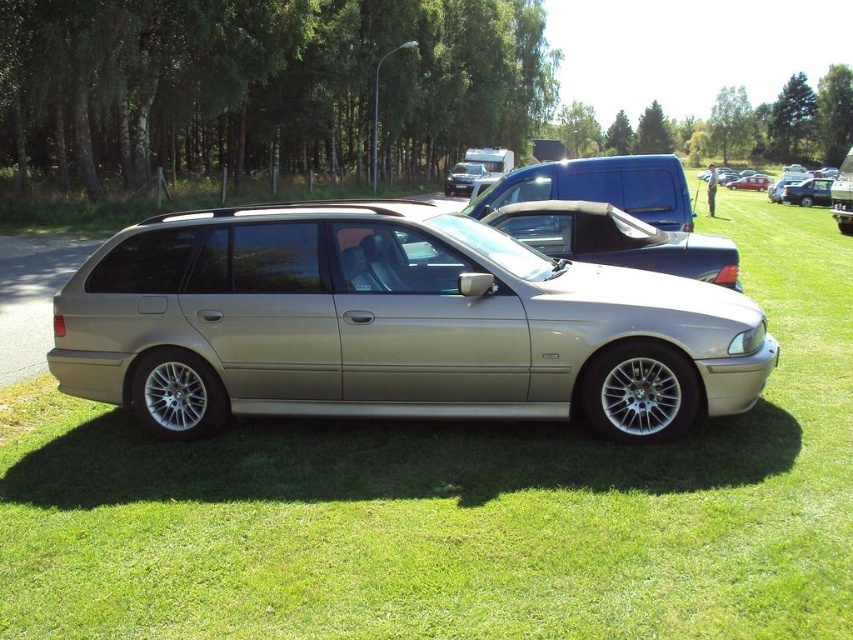
Question: Which object appears farthest from the camera in this image?

Choices:
 (A) blue matte van at center
 (B) metallic silver sedan at center
 (C) black plastic license plate at center

Answer: (B)

Question: Does metallic silver sedan at center appear under black plastic license plate at center?

Choices:
 (A) yes
 (B) no

Answer: (B)

Question: Which of the following is the closest to the observer?

Choices:
 (A) (635, 516)
 (B) (103, 296)
 (C) (827, 177)

Answer: (A)

Question: Which object appears farthest from the camera in this image?

Choices:
 (A) metallic silver car at center
 (B) metallic silver station wagon at center
 (C) blue matte van at center

Answer: (B)

Question: Is metallic silver car at center wider than metallic silver sedan at center?

Choices:
 (A) yes
 (B) no

Answer: (A)

Question: Considering the relative positions of satin silver car at center and metallic silver station wagon at center in the image provided, where is satin silver car at center located with respect to metallic silver station wagon at center?

Choices:
 (A) above
 (B) below

Answer: (B)